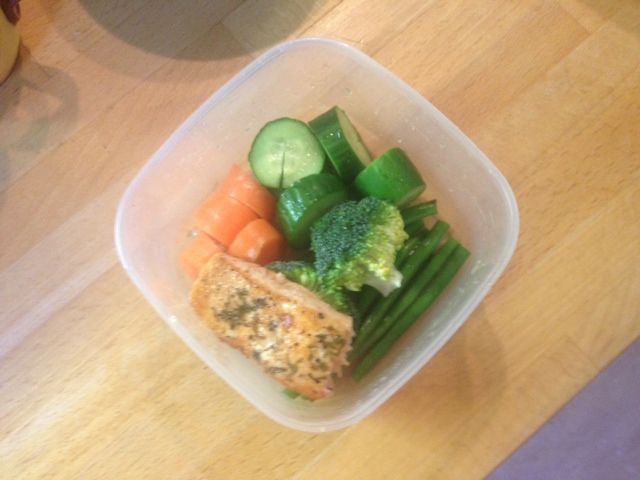
Where is `plastic container`? plastic container is located at coordinates (159, 193).